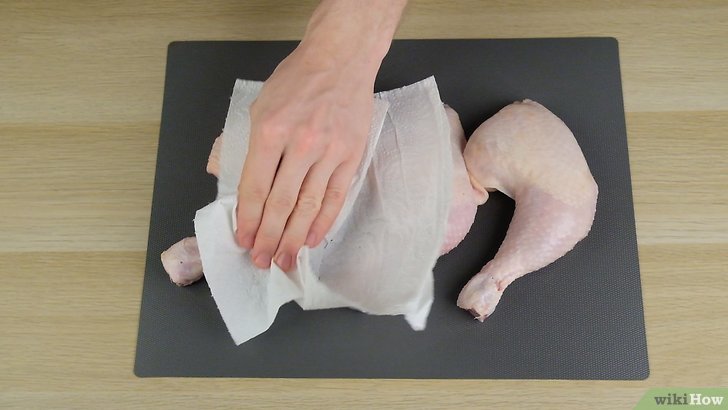
Locate an element on the screen. Image resolution: width=728 pixels, height=410 pixels. chopping mat is located at coordinates (523, 354).